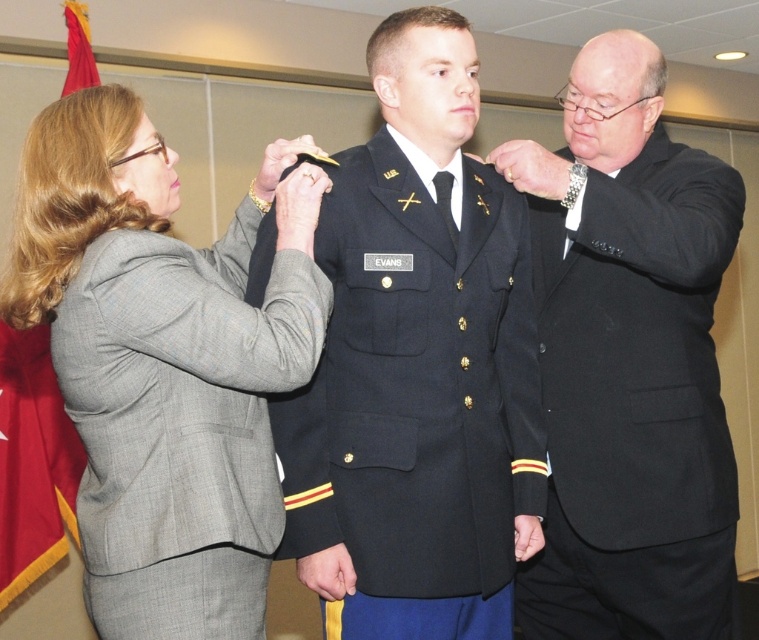
Does gray wool suit at left have a lesser width compared to black suit at right?

In fact, gray wool suit at left might be wider than black suit at right.

You are a GUI agent. You are given a task and a screenshot of the screen. Output one action in this format:
    pyautogui.click(x=<x>, y=<y>)
    Task: Click on the gray wool suit at left
    This screenshot has height=640, width=759.
    Given the screenshot: What is the action you would take?
    pyautogui.click(x=164, y=362)

Where is `gray wool suit at left`? The width and height of the screenshot is (759, 640). gray wool suit at left is located at coordinates (164, 362).

The height and width of the screenshot is (640, 759). I want to click on gray wool suit at left, so click(164, 362).

Can you confirm if gray wool suit at left is positioned to the right of navy blue wool uniform at center?

No, gray wool suit at left is not to the right of navy blue wool uniform at center.

Measure the distance from gray wool suit at left to navy blue wool uniform at center.

They are 9.76 inches apart.

Is point (263, 497) positioned in front of point (358, 397)?

Yes, point (263, 497) is in front of point (358, 397).

Locate an element on the screen. gray wool suit at left is located at coordinates (164, 362).

Is black suit at right to the right of navy blue wool uniform at center from the viewer's perspective?

Indeed, black suit at right is positioned on the right side of navy blue wool uniform at center.

From the picture: Is black suit at right below navy blue wool uniform at center?

Actually, black suit at right is above navy blue wool uniform at center.

Find the location of a particular element. This screenshot has height=640, width=759. black suit at right is located at coordinates (628, 362).